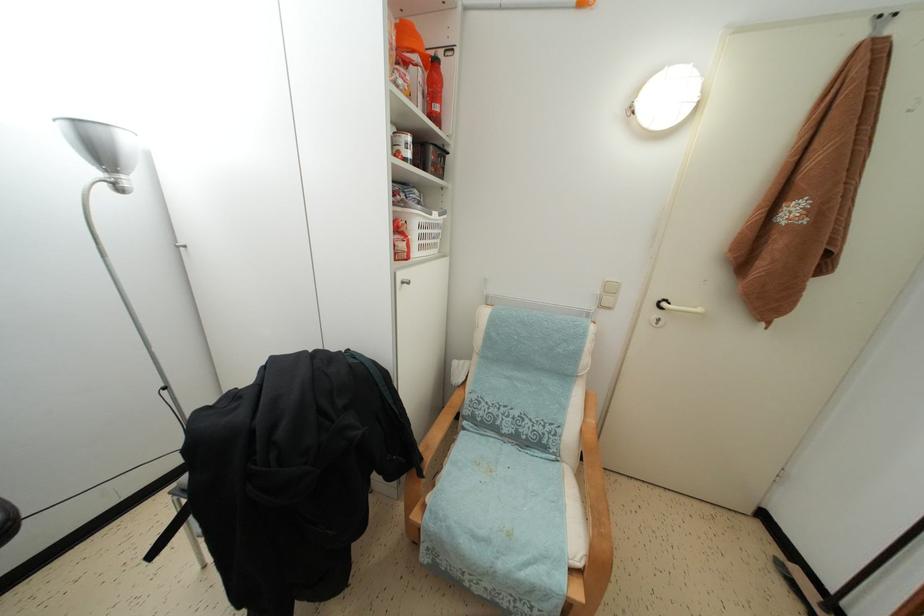
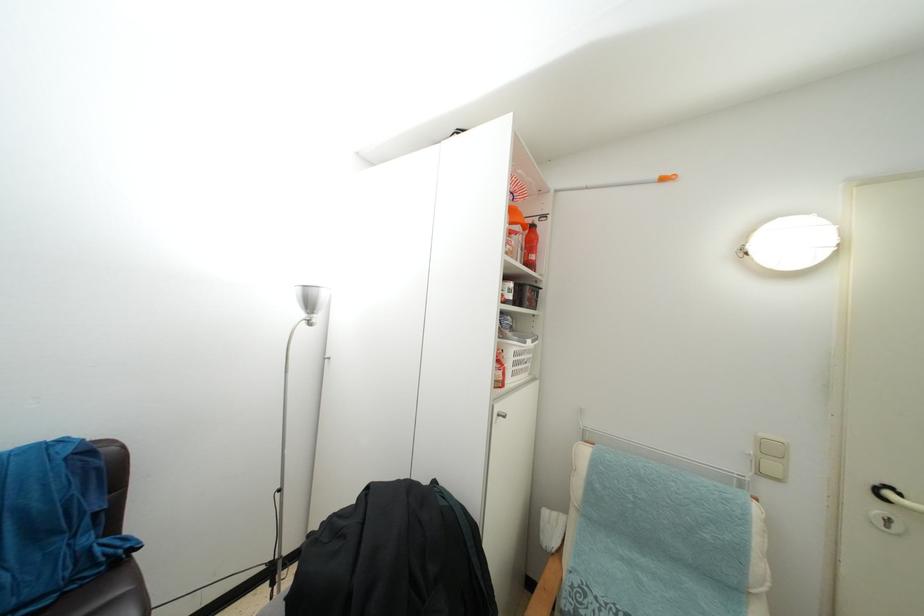
Where in the second image is the point corresponding to (x=70, y=131) from the first image?

(304, 294)